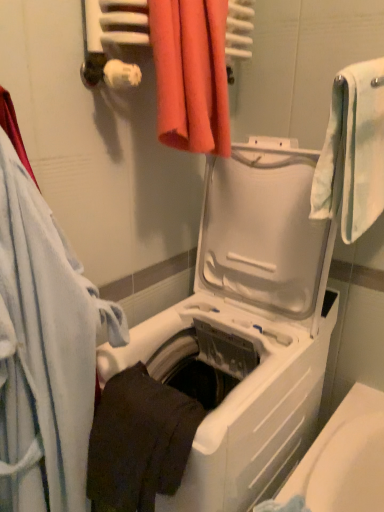
Question: Considering the positions of dark matte towel at lower center, which is counted as the third towel, starting from the right, and white soft towel at right, which is the fourth towel from left to right, in the image, is dark matte towel at lower center, which is counted as the third towel, starting from the right, bigger or smaller than white soft towel at right, which is the fourth towel from left to right,?

Choices:
 (A) big
 (B) small

Answer: (B)

Question: From a real-world perspective, is dark matte towel at lower center, arranged as the second towel when viewed from the left, positioned above or below white soft towel at right, which is the fourth towel from left to right?

Choices:
 (A) below
 (B) above

Answer: (A)

Question: Which object is positioned closest to the white soft towel at left, the first towel viewed from the left?

Choices:
 (A) orange fabric towel at upper center, the 2th towel when ordered from right to left
 (B) white soft towel at right, which is the fourth towel from left to right
 (C) white plastic washing machine at center
 (D) dark matte towel at lower center, arranged as the second towel when viewed from the left

Answer: (D)

Question: Considering the real-world distances, which object is farthest from the white soft towel at right, the first towel positioned from the right?

Choices:
 (A) white plastic washing machine at center
 (B) white soft towel at left, the first towel viewed from the left
 (C) orange fabric towel at upper center, the third towel in the left-to-right sequence
 (D) dark matte towel at lower center, which is counted as the third towel, starting from the right

Answer: (B)